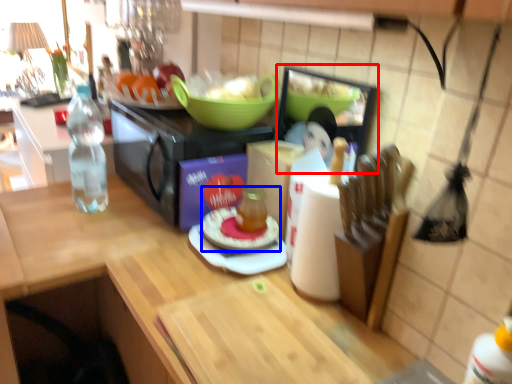
Question: Which object is closer to the camera taking this photo, appliance (highlighted by a red box) or meal (highlighted by a blue box)?

Choices:
 (A) appliance
 (B) meal

Answer: (A)